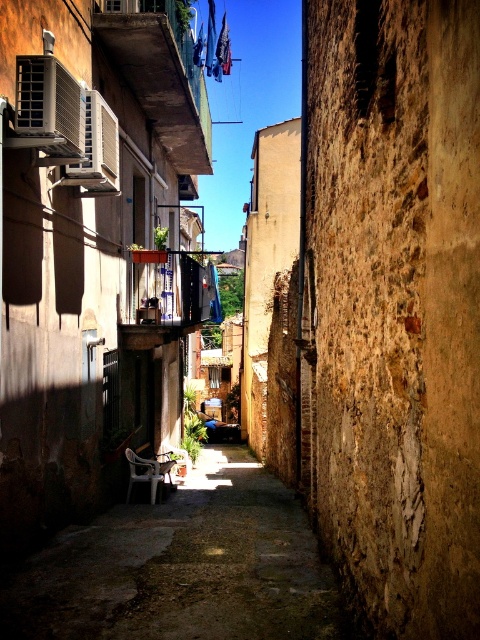
You are standing at the entrance of the alleyway and want to take a photo of the rustic stone wall at center. Where should you position yourself to capture it in the frame?

The rustic stone wall at center is located at point 0.480 on the x and 0.821 on the y coordinates, so you should position yourself directly in front of it to ensure it is centered in your photo.

You are standing in the narrow alleyway between two buildings. You see a point marked at coordinates (394, 307). Based on the scene description, where is this point located?

The point at (394, 307) is on the rustic stone wall at center.